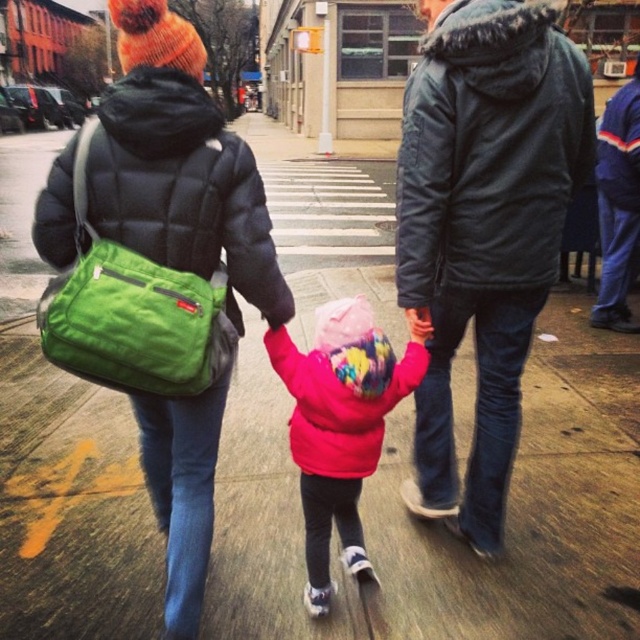
Identify the location of matte black jacket at upper left. The image size is (640, 640). (182, 188).

Who is more forward, (253, 182) or (605, 273)?

Point (253, 182) is more forward.

Does point (176, 96) lie behind point (637, 134)?

No, it is not.

Between point (244, 212) and point (600, 116), which one is positioned in front?

Point (244, 212)

Identify the location of green fabric bag at upper left. (160, 273).

Which is in front, point (84, 333) or point (168, 141)?

Point (84, 333) is in front.

Is green fabric bag at upper left to the left of matte black jacket at upper left from the viewer's perspective?

No, green fabric bag at upper left is not to the left of matte black jacket at upper left.

What are the coordinates of `green fabric bag at upper left` in the screenshot? It's located at (160, 273).